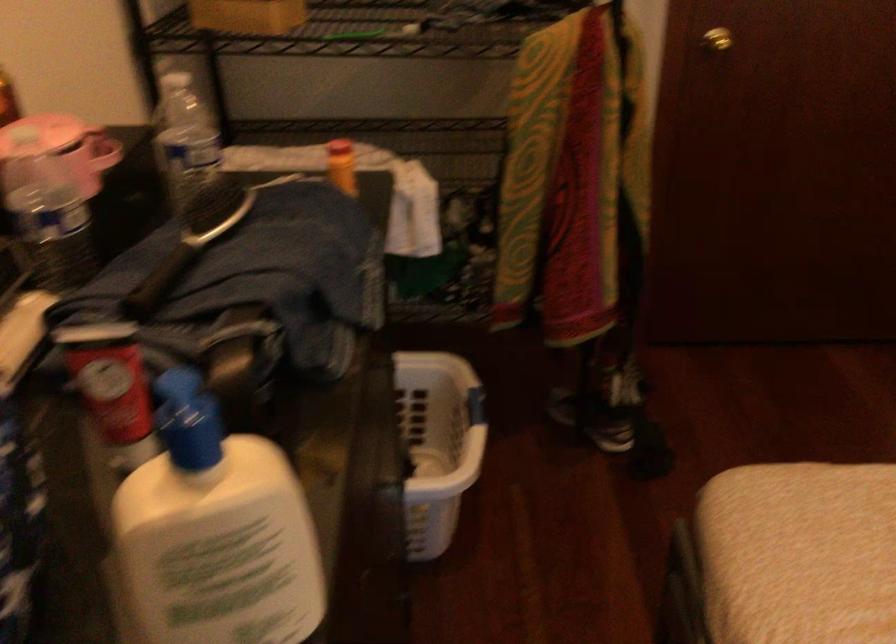
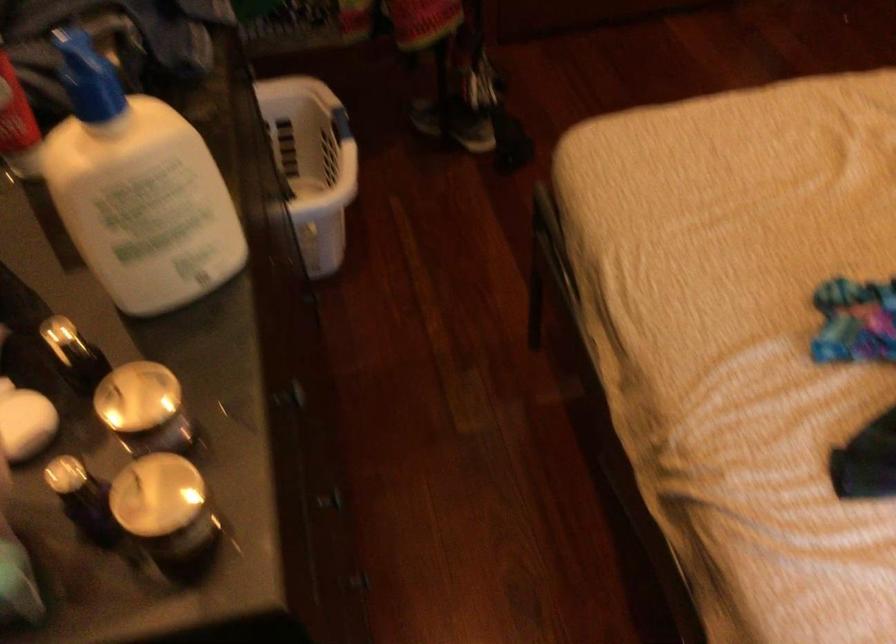
Find the pixel in the second image that matches point (440, 440) in the first image.

(312, 164)